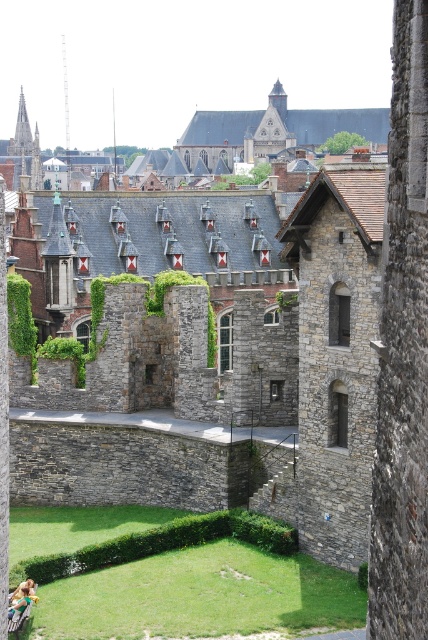
You are standing in the courtyard looking at the historic stone structure. You notice two points marked on the structure. Which point, point [59,557] or point [14,602], is closer to you?

Point [59,557] is closer to you because it is further to the viewer than point [14,602].

You are standing at the entrance of the historic stone structure and want to reach the green grass at lower center. According to the coordinates provided, where should you head to find it?

The green grass at lower center is located at point (162,544), so you should head towards the lower center area to find it.

You are a gardener tasked with maintaining the green grass at lower center and the smooth stone spire at upper left. Which of these two objects is taller?

The smooth stone spire at upper left is taller than the green grass at lower center.